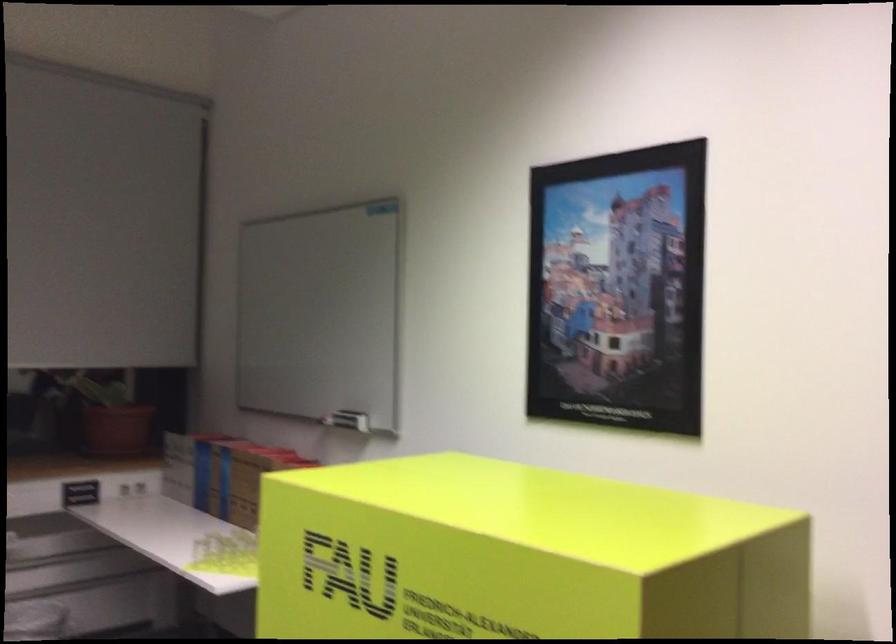
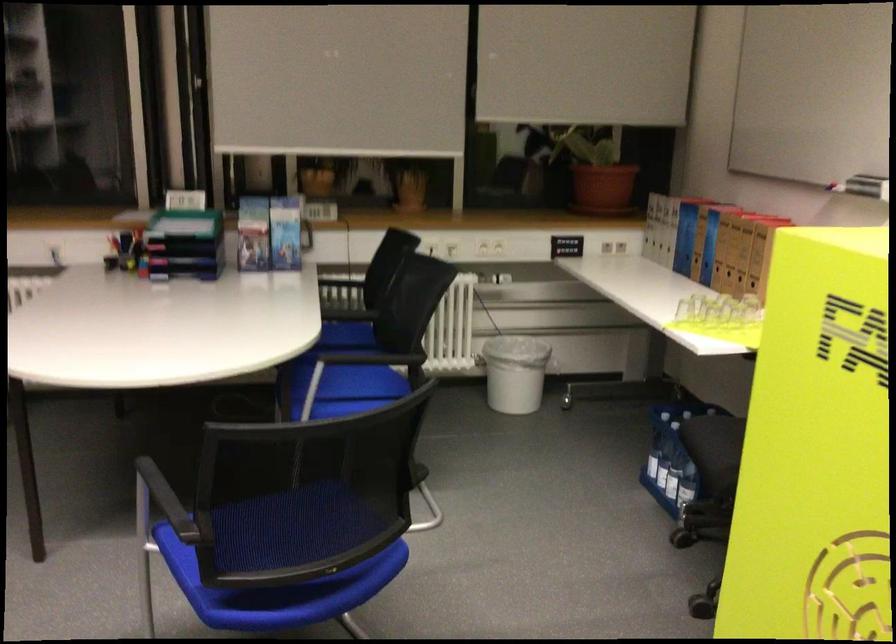
The point at (121, 431) is marked in the first image. Where is the corresponding point in the second image?

(602, 187)